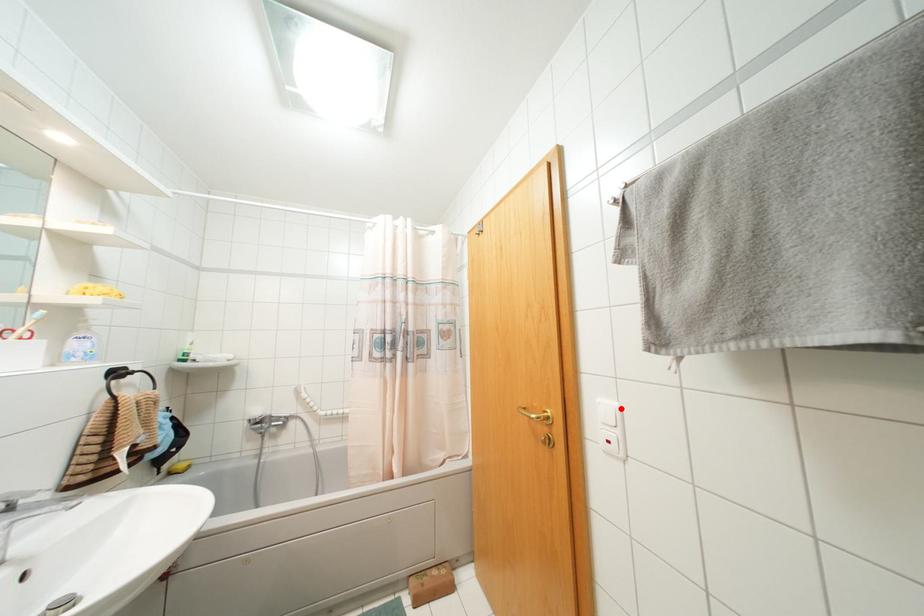
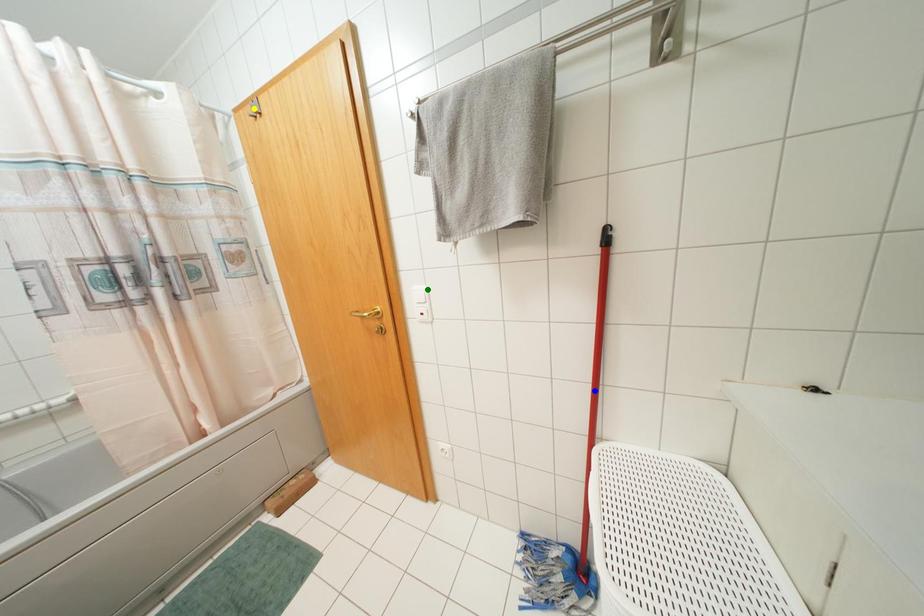
Question: I am providing you with two images of the same scene from different viewpoints. A red point is marked on the first image. You are given multiple points on the second image. Which point in image 2 represents the same 3d spot as the red point in image 1?

Choices:
 (A) yellow point
 (B) green point
 (C) blue point

Answer: (B)